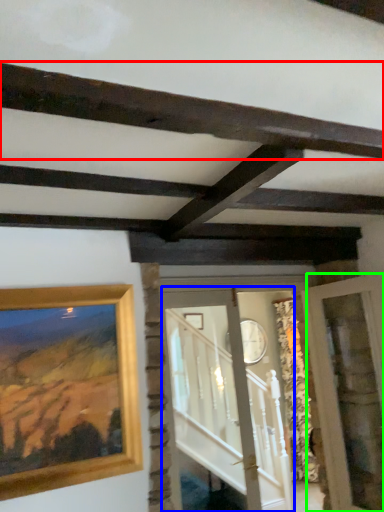
Question: Which is farther away from plank (highlighted by a red box)? glass door (highlighted by a blue box) or glass door (highlighted by a green box)?

Choices:
 (A) glass door
 (B) glass door

Answer: (A)